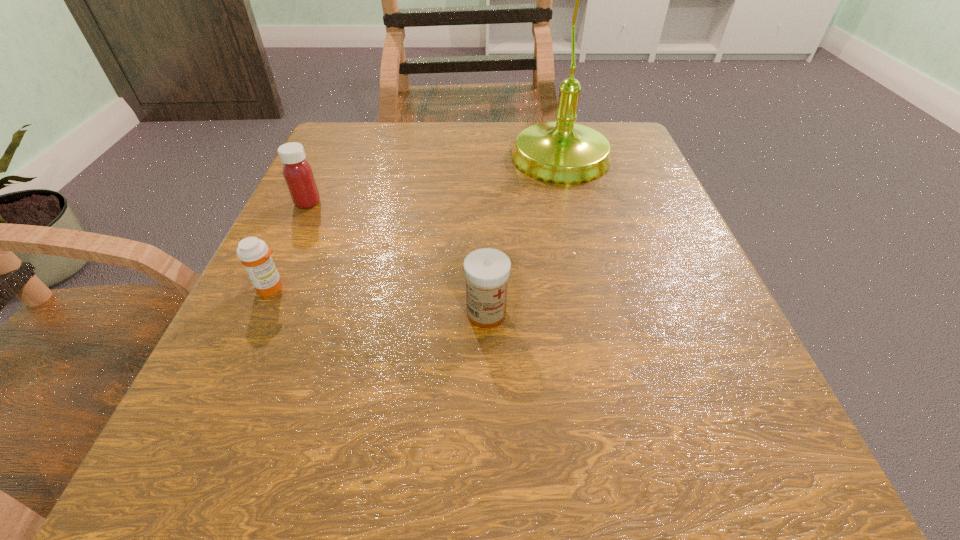
Locate an element on the screen. This screenshot has width=960, height=540. vacant area located on the front of the second nearest object is located at coordinates (206, 429).

Locate an element on the screen. The width and height of the screenshot is (960, 540). object that is at the far edge is located at coordinates (561, 152).

This screenshot has height=540, width=960. Find the location of `object that is positioned at the right edge`. object that is positioned at the right edge is located at coordinates (x=561, y=152).

Identify the location of object that is at the far right corner. The width and height of the screenshot is (960, 540). (561, 152).

The height and width of the screenshot is (540, 960). In the image, there is a desktop. In order to click on vacant space at the far edge in this screenshot , I will do `click(504, 177)`.

The image size is (960, 540). What are the coordinates of `vacant region at the near edge of the desktop` in the screenshot? It's located at (407, 457).

The width and height of the screenshot is (960, 540). In the image, there is a desktop. Find the location of `free space at the left edge`. free space at the left edge is located at coordinates (323, 368).

You are a GUI agent. You are given a task and a screenshot of the screen. Output one action in this format:
    pyautogui.click(x=<x>, y=<y>)
    Task: Click on the free space at the right edge of the desktop
    
    Given the screenshot: What is the action you would take?
    pyautogui.click(x=649, y=247)

At what (x,y) coordinates should I click in order to perform the action: click on vacant space at the far left corner of the desktop. Please return your answer as a coordinate pair (x, y). This screenshot has height=540, width=960. Looking at the image, I should click on (351, 123).

Image resolution: width=960 pixels, height=540 pixels. I want to click on vacant space that is in between the second farthest medicine and the lamp, so click(x=417, y=225).